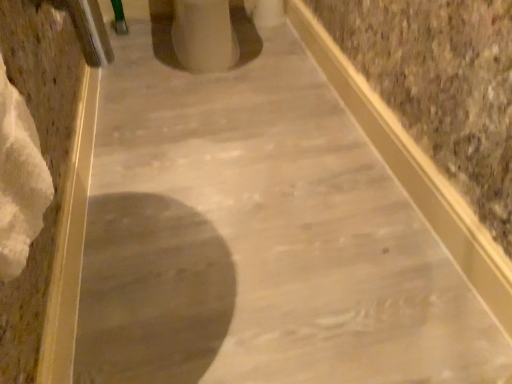
What do you see at coordinates (202, 35) in the screenshot? I see `white matte toilet at upper center` at bounding box center [202, 35].

Find the location of a particular element. white matte toilet at upper center is located at coordinates (202, 35).

In order to click on white matte toilet at upper center in this screenshot , I will do `click(202, 35)`.